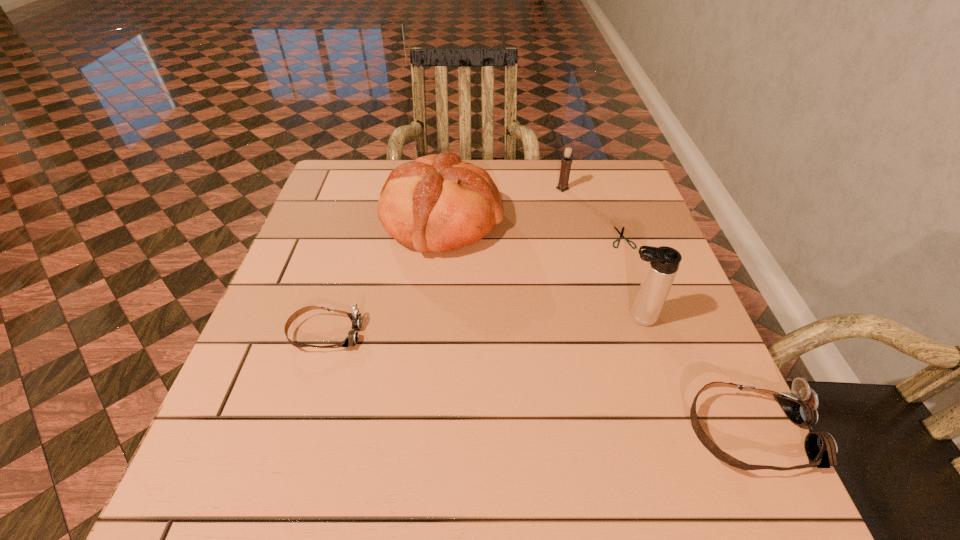
In order to click on vacant area that lies between the thermos bottle and the shortest object in this screenshot , I will do `click(629, 278)`.

Identify which object is the third nearest to the shears. Please provide its 2D coordinates. Your answer should be formatted as a tuple, i.e. [(x, y)], where the tuple contains the x and y coordinates of a point satisfying the conditions above.

[(437, 203)]

Identify the location of object that stands as the third closest to the third shortest object. (437, 203).

Identify the location of vacant space that satisfies the following two spatial constraints: 1. on the front side of the bread; 2. on the front-facing side of the second shortest object. click(430, 334).